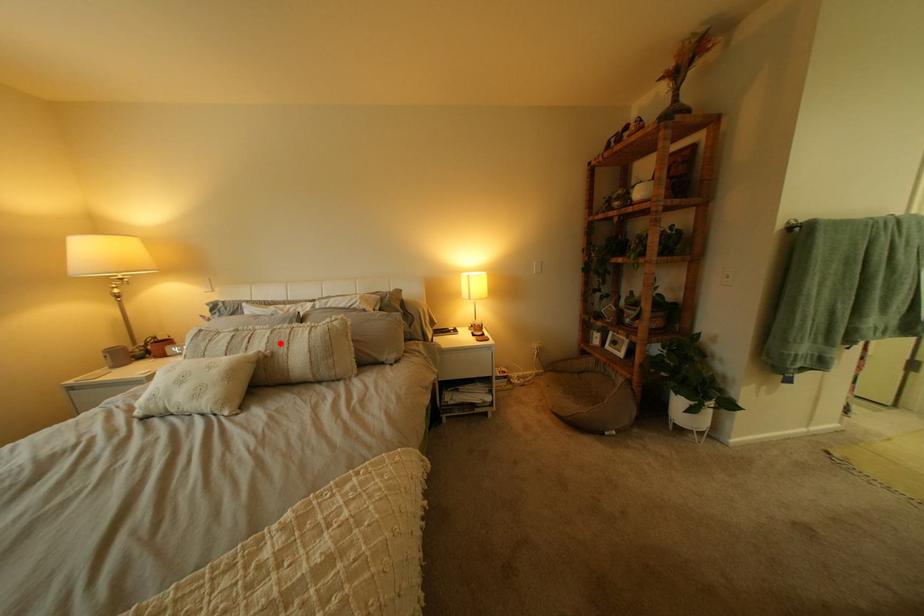
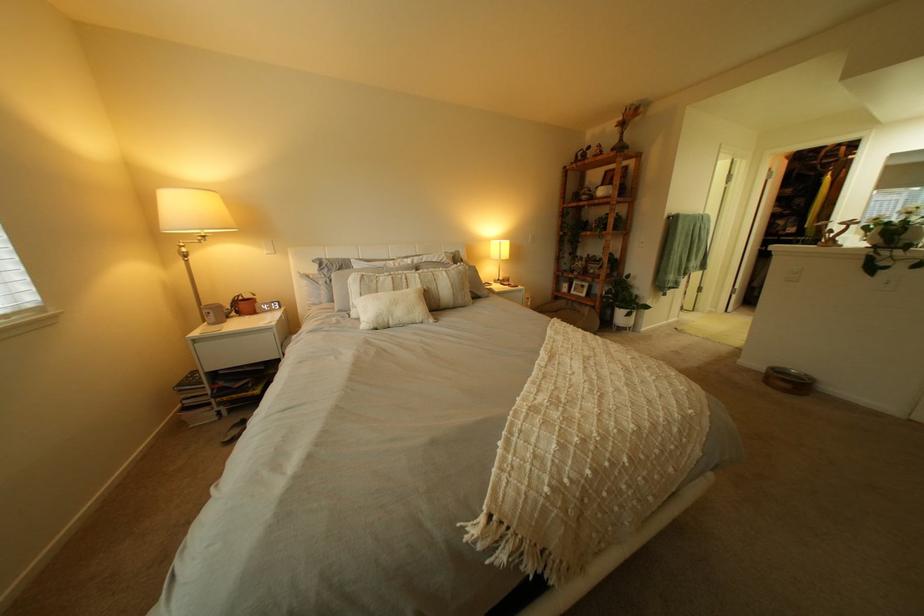
Where in the second image is the point corresponding to the highlighted location from the first image?

(434, 283)